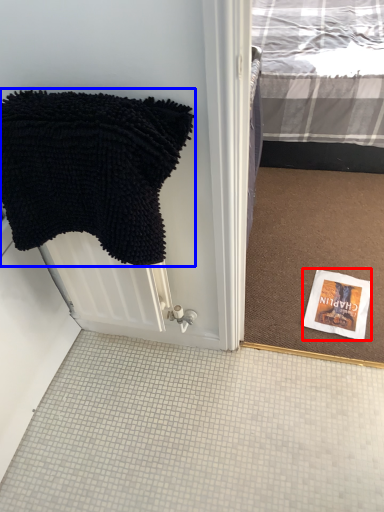
Question: Among these objects, which one is farthest to the camera, book cover (highlighted by a red box) or towel (highlighted by a blue box)?

Choices:
 (A) book cover
 (B) towel

Answer: (A)